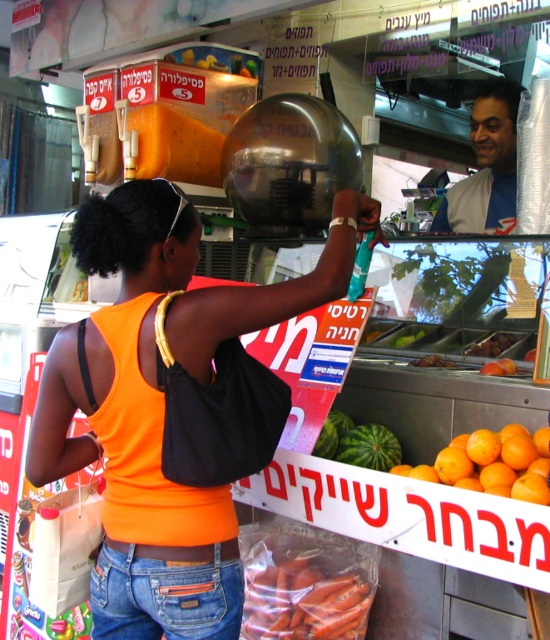
Is orange plastic carrots at lower center further to camera compared to smooth plastic face at upper right?

A: That is False.

Does orange plastic carrots at lower center appear on the right side of smooth plastic face at upper right?

Incorrect, orange plastic carrots at lower center is not on the right side of smooth plastic face at upper right.

Measure the distance between point [312,564] and camera.

A distance of 6.27 feet exists between point [312,564] and camera.

The image size is (550, 640). What are the coordinates of `orange plastic carrots at lower center` in the screenshot? It's located at (308, 593).

Does orange fabric tank top at center appear on the left side of jeans at lower center?

No, orange fabric tank top at center is not to the left of jeans at lower center.

Is orange fabric tank top at center positioned at the back of jeans at lower center?

Yes, orange fabric tank top at center is behind jeans at lower center.

Is point (160, 285) closer to camera compared to point (114, 624)?

No, (160, 285) is behind (114, 624).

Find the location of a particular element. orange fabric tank top at center is located at coordinates (162, 403).

Which of these two, orange fabric tank top at center or orange plastic carrots at lower center, stands shorter?

With less height is orange plastic carrots at lower center.

Does orange fabric tank top at center come behind orange plastic carrots at lower center?

That is False.

Locate an element on the screen. This screenshot has width=550, height=640. orange fabric tank top at center is located at coordinates [162, 403].